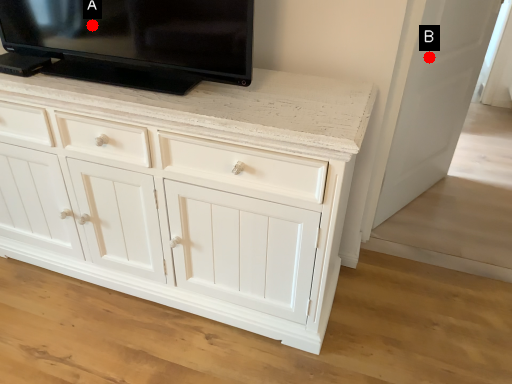
Question: Two points are circled on the image, labeled by A and B beside each circle. Which point appears closest to the camera in this image?

Choices:
 (A) A is closer
 (B) B is closer

Answer: (A)